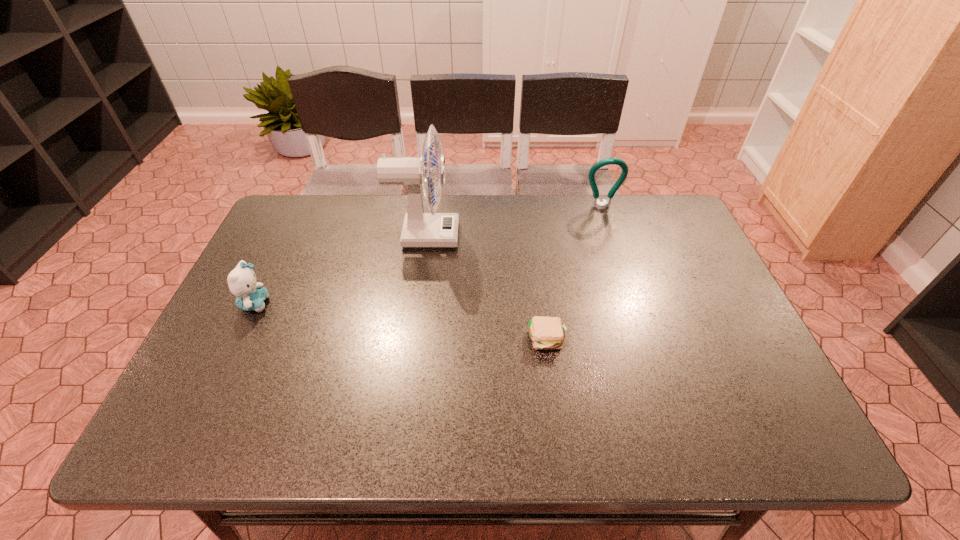
What are the coordinates of `vacant space located 0.390m on the face of the kitten` in the screenshot? It's located at (419, 303).

Where is `blank space located on the back of the second object from right to left`? blank space located on the back of the second object from right to left is located at coordinates 542,308.

Find the location of a particular element. This screenshot has height=540, width=960. fan present at the far edge is located at coordinates (420, 230).

Where is `bottle opener present at the far edge`? The height and width of the screenshot is (540, 960). bottle opener present at the far edge is located at coordinates (596, 203).

At what (x,y) coordinates should I click in order to perform the action: click on object that is at the left edge. Please return your answer as a coordinate pair (x, y). The image size is (960, 540). Looking at the image, I should click on (250, 295).

In the image, there is a desktop. Find the location of `vacant space at the far edge`. vacant space at the far edge is located at coordinates (501, 205).

In the image, there is a desktop. Where is `free space at the near edge`? The width and height of the screenshot is (960, 540). free space at the near edge is located at coordinates (560, 428).

The image size is (960, 540). I want to click on free space at the left edge, so click(289, 267).

Where is `vacant area at the right edge`? The image size is (960, 540). vacant area at the right edge is located at coordinates (756, 375).

Image resolution: width=960 pixels, height=540 pixels. Identify the location of free spot at the far left corner of the desktop. (276, 226).